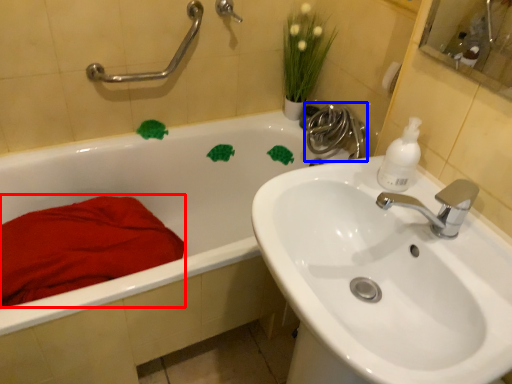
Question: Which object appears farthest to the camera in this image, blanket (highlighted by a red box) or plumbing fixture (highlighted by a blue box)?

Choices:
 (A) blanket
 (B) plumbing fixture

Answer: (B)